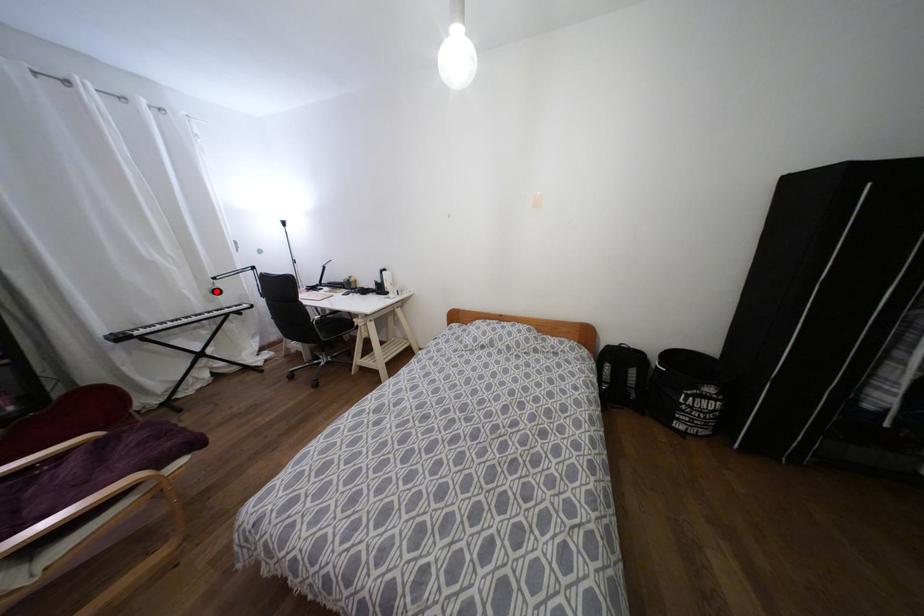
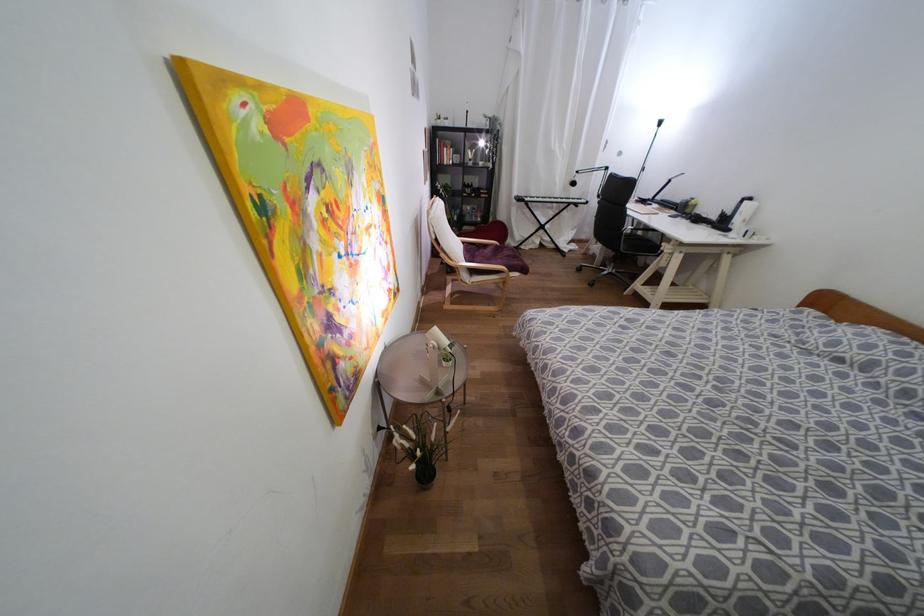
Where in the second image is the point corresponding to the highlighted location from the first image?

(573, 183)